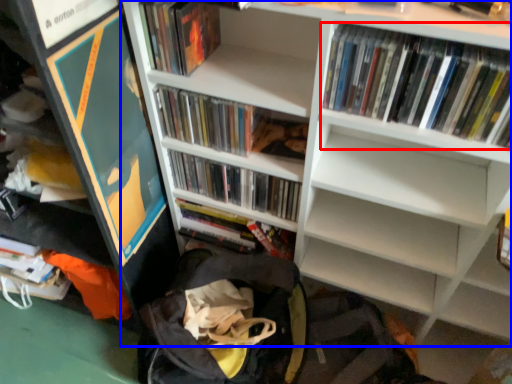
Question: Which object is further to the camera taking this photo, book (highlighted by a red box) or bookcase (highlighted by a blue box)?

Choices:
 (A) book
 (B) bookcase

Answer: (A)